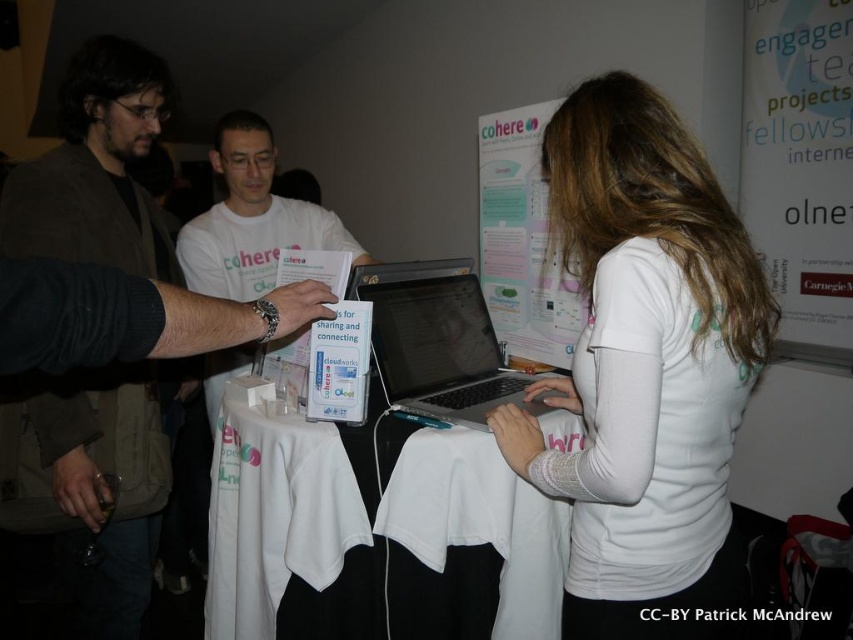
Between white cloth-covered table at center and white matte t-shirt at center, which one appears on the left side from the viewer's perspective?

white matte t-shirt at center

Who is more distant from viewer, (360,580) or (241,362)?

Point (241,362)

Locate an element on the screen. The image size is (853, 640). white cloth-covered table at center is located at coordinates (376, 532).

Which of these two, white matte shirt at center or matte black laptop at left, stands shorter?

Standing shorter between the two is white matte shirt at center.

Who is more distant from viewer, (x=662, y=241) or (x=33, y=499)?

The point (x=33, y=499) is behind.

Locate an element on the screen. Image resolution: width=853 pixels, height=640 pixels. white matte shirt at center is located at coordinates point(646,369).

Is white matte shirt at center positioned behind white paper at upper right?

No, white matte shirt at center is closer to the viewer.

Does white matte shirt at center have a larger size compared to white paper at upper right?

Yes, white matte shirt at center is bigger than white paper at upper right.

Is point (694, 548) closer to viewer compared to point (834, 28)?

Yes, it is in front of point (834, 28).

Find the location of a particular element. The image size is (853, 640). white matte shirt at center is located at coordinates (646, 369).